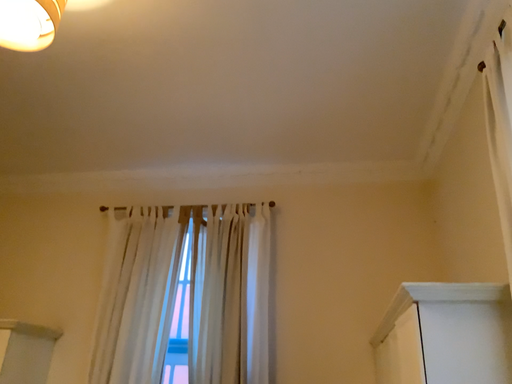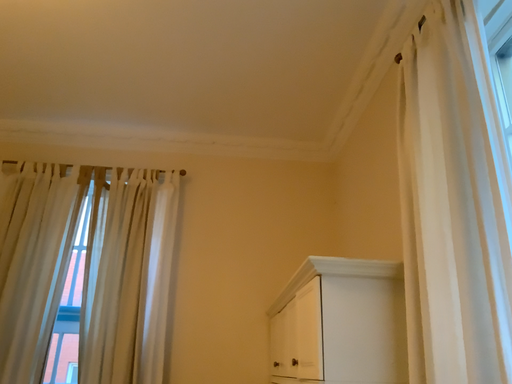
Question: How did the camera likely rotate when shooting the video?

Choices:
 (A) rotated left
 (B) rotated right

Answer: (B)